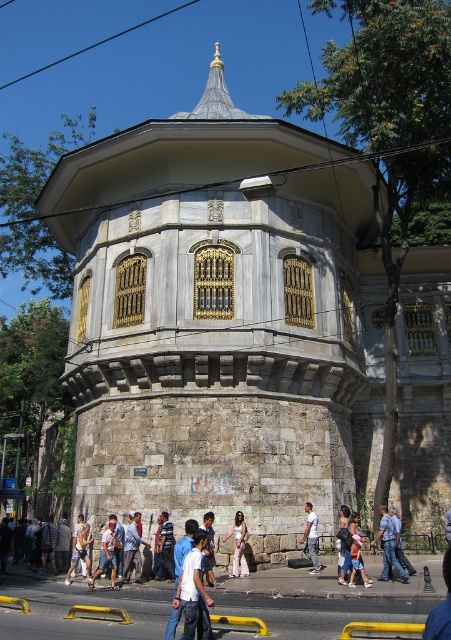
You are standing in front of the historical structure described. You notice the stone tower at center and the light blue jeans at center. Which object is positioned higher from the ground?

The stone tower at center is above light blue jeans at center, so the stone tower at center is positioned higher from the ground.

You are standing at the entrance of this historical building and notice a pair of blue denim jeans at center lying on the ground. If you want to retrieve them without moving from your current position, can you reach them?

The blue denim jeans at center is 105.86 feet away from the camera, so you cannot reach them without moving from your current position.